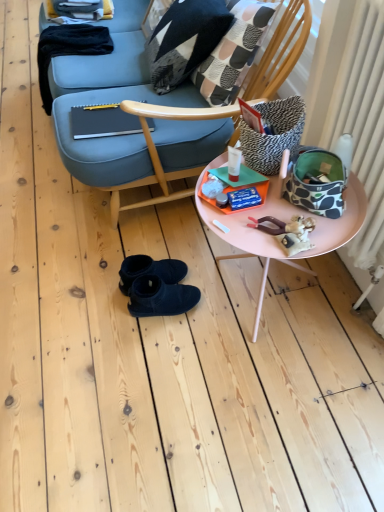
Question: Does black-and-white geometric-patterned pillow at upper center, marked as the first pillow in a back-to-front arrangement, have a greater width compared to zebra-patterned fabric pillow at upper right, positioned as the second pillow in left-to-right order?

Choices:
 (A) no
 (B) yes

Answer: (A)

Question: Does black-and-white geometric-patterned pillow at upper center, marked as the first pillow in a back-to-front arrangement, appear on the right side of zebra-patterned fabric pillow at upper right, the 1th pillow in the front-to-back sequence?

Choices:
 (A) no
 (B) yes

Answer: (A)

Question: Is the depth of black-and-white geometric-patterned pillow at upper center, marked as the first pillow in a back-to-front arrangement, greater than that of zebra-patterned fabric pillow at upper right, positioned as the 1th pillow in right-to-left order?

Choices:
 (A) no
 (B) yes

Answer: (B)

Question: Is black-and-white geometric-patterned pillow at upper center, which ranks as the second pillow in front-to-back order, outside zebra-patterned fabric pillow at upper right, positioned as the second pillow in left-to-right order?

Choices:
 (A) yes
 (B) no

Answer: (A)

Question: Considering the relative sizes of black-and-white geometric-patterned pillow at upper center, the 1th pillow positioned from the top, and zebra-patterned fabric pillow at upper right, marked as the second pillow in a back-to-front arrangement, in the image provided, is black-and-white geometric-patterned pillow at upper center, the 1th pillow positioned from the top, smaller than zebra-patterned fabric pillow at upper right, marked as the second pillow in a back-to-front arrangement,?

Choices:
 (A) no
 (B) yes

Answer: (A)

Question: Considering the relative sizes of black-and-white geometric-patterned pillow at upper center, the 1th pillow positioned from the top, and zebra-patterned fabric pillow at upper right, arranged as the second pillow when viewed from the top, in the image provided, is black-and-white geometric-patterned pillow at upper center, the 1th pillow positioned from the top, taller than zebra-patterned fabric pillow at upper right, arranged as the second pillow when viewed from the top,?

Choices:
 (A) yes
 (B) no

Answer: (A)

Question: From a real-world perspective, is zebra-patterned fabric pillow at upper right, positioned as the 1th pillow in right-to-left order, on black-and-white geometric-patterned pillow at upper center, the 1th pillow positioned from the top?

Choices:
 (A) yes
 (B) no

Answer: (A)

Question: Is zebra-patterned fabric pillow at upper right, marked as the second pillow in a back-to-front arrangement, thinner than black-and-white geometric-patterned pillow at upper center, the 1th pillow positioned from the top?

Choices:
 (A) no
 (B) yes

Answer: (A)

Question: Is black-and-white geometric-patterned pillow at upper center, which ranks as the second pillow in front-to-back order, surrounded by zebra-patterned fabric pillow at upper right, arranged as the second pillow when viewed from the top?

Choices:
 (A) yes
 (B) no

Answer: (B)

Question: Considering the relative sizes of zebra-patterned fabric pillow at upper right, the 1th pillow in the front-to-back sequence, and black-and-white geometric-patterned pillow at upper center, marked as the first pillow in a back-to-front arrangement, in the image provided, is zebra-patterned fabric pillow at upper right, the 1th pillow in the front-to-back sequence, shorter than black-and-white geometric-patterned pillow at upper center, marked as the first pillow in a back-to-front arrangement,?

Choices:
 (A) no
 (B) yes

Answer: (B)

Question: Is zebra-patterned fabric pillow at upper right, positioned as the 1th pillow in right-to-left order, far from black-and-white geometric-patterned pillow at upper center, positioned as the 2th pillow in bottom-to-top order?

Choices:
 (A) no
 (B) yes

Answer: (A)

Question: Is zebra-patterned fabric pillow at upper right, the 1th pillow positioned from the bottom, bigger than black-and-white geometric-patterned pillow at upper center, positioned as the 2th pillow in bottom-to-top order?

Choices:
 (A) yes
 (B) no

Answer: (B)

Question: Is zebra-patterned fabric pillow at upper right, positioned as the second pillow in left-to-right order, placed right next to patchwork fabric throw pillow at upper center?

Choices:
 (A) no
 (B) yes

Answer: (A)